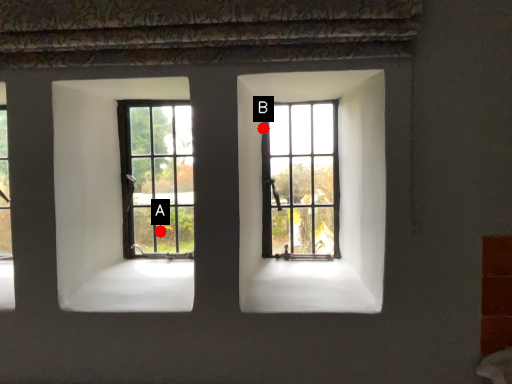
Question: Two points are circled on the image, labeled by A and B beside each circle. Among these points, which one is nearest to the camera?

Choices:
 (A) A is closer
 (B) B is closer

Answer: (B)